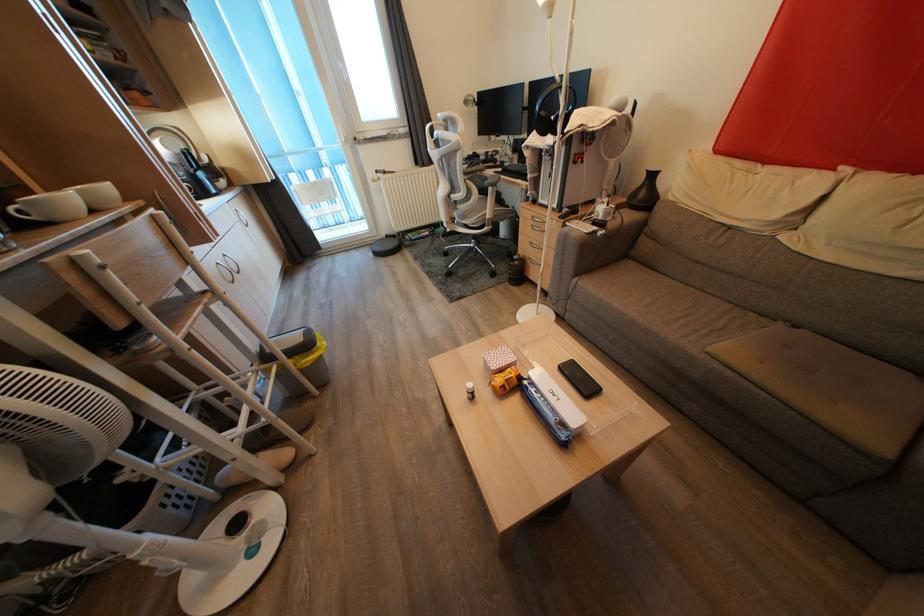
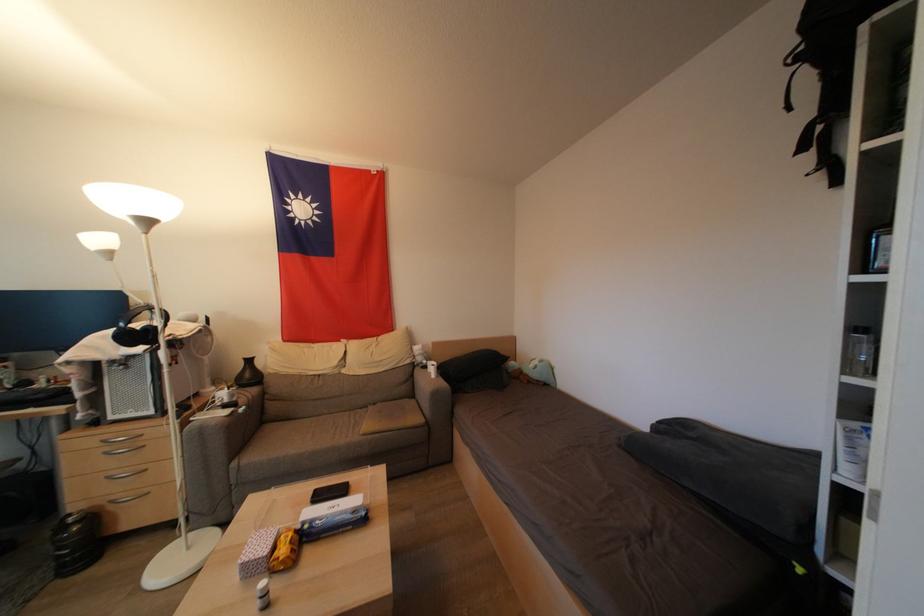
Find the pixel in the second image that matches pixel 538 245 in the first image.

(117, 477)